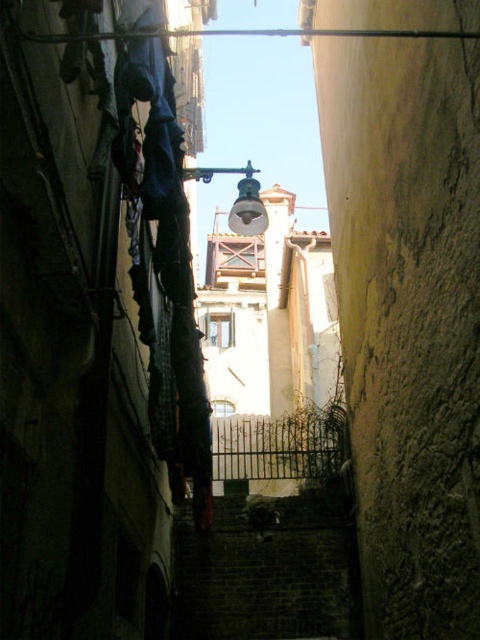
Question: Does dark brick stairwell at center appear on the left side of metallic glass at upper center?

Choices:
 (A) yes
 (B) no

Answer: (B)

Question: Is dark brick stairwell at center in front of metallic glass at upper center?

Choices:
 (A) no
 (B) yes

Answer: (A)

Question: Among these objects, which one is nearest to the camera?

Choices:
 (A) metallic glass at upper center
 (B) dark brick stairwell at center

Answer: (A)

Question: Is dark brick stairwell at center to the right of metallic glass at upper center from the viewer's perspective?

Choices:
 (A) yes
 (B) no

Answer: (A)

Question: Which point is closer to the camera taking this photo?

Choices:
 (A) (297, 529)
 (B) (252, 170)

Answer: (B)

Question: Which point appears closest to the camera in this image?

Choices:
 (A) (322, 550)
 (B) (233, 230)

Answer: (A)